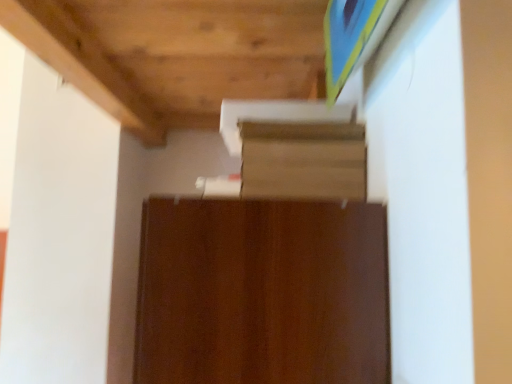
Question: From the image's perspective, is brown wood cabinet at center positioned above or below wooden shelf at upper center?

Choices:
 (A) above
 (B) below

Answer: (B)

Question: In terms of size, does brown wood cabinet at center appear bigger or smaller than wooden shelf at upper center?

Choices:
 (A) small
 (B) big

Answer: (B)

Question: Is brown wood cabinet at center taller or shorter than wooden shelf at upper center?

Choices:
 (A) tall
 (B) short

Answer: (A)

Question: In terms of size, does wooden shelf at upper center appear bigger or smaller than brown wood cabinet at center?

Choices:
 (A) small
 (B) big

Answer: (A)

Question: Visually, is wooden shelf at upper center positioned to the left or to the right of brown wood cabinet at center?

Choices:
 (A) left
 (B) right

Answer: (B)

Question: In terms of width, does wooden shelf at upper center look wider or thinner when compared to brown wood cabinet at center?

Choices:
 (A) thin
 (B) wide

Answer: (A)

Question: From the image's perspective, is wooden shelf at upper center positioned above or below brown wood cabinet at center?

Choices:
 (A) above
 (B) below

Answer: (A)